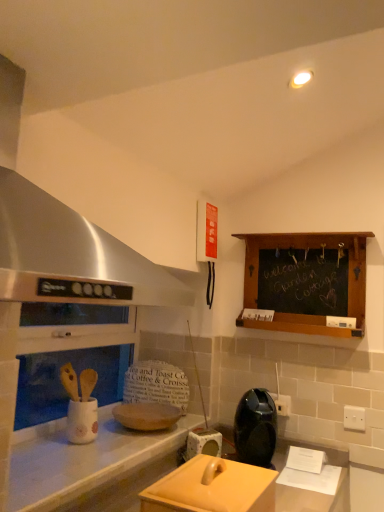
Question: From the image's perspective, is white plastic electric outlet at upper right, the first electric outlet from the right, on top of black plastic electric outlet at center-right, positioned as the 1th electric outlet in left-to-right order?

Choices:
 (A) no
 (B) yes

Answer: (A)

Question: Can you confirm if white plastic electric outlet at upper right, the 2th electric outlet in the left-to-right sequence, is smaller than black plastic electric outlet at center-right, which appears as the second electric outlet when viewed from the right?

Choices:
 (A) yes
 (B) no

Answer: (A)

Question: Does white plastic electric outlet at upper right, the second electric outlet in the back-to-front sequence, appear on the left side of black plastic electric outlet at center-right, the first electric outlet in the back-to-front sequence?

Choices:
 (A) yes
 (B) no

Answer: (B)

Question: Is white plastic electric outlet at upper right, the 2th electric outlet in the left-to-right sequence, taller than black plastic electric outlet at center-right, positioned as the 1th electric outlet in left-to-right order?

Choices:
 (A) yes
 (B) no

Answer: (A)

Question: From a real-world perspective, is white plastic electric outlet at upper right, which ranks as the 1th electric outlet in front-to-back order, physically below black plastic electric outlet at center-right, the 2th electric outlet when ordered from front to back?

Choices:
 (A) no
 (B) yes

Answer: (B)

Question: From the image's perspective, is matte beige toaster at center, arranged as the 1th appliance when viewed from the back, located above or below stainless steel exhaust hood at upper left?

Choices:
 (A) above
 (B) below

Answer: (B)

Question: In the image, is matte beige toaster at center, positioned as the 3th appliance in front-to-back order, positioned in front of or behind stainless steel exhaust hood at upper left?

Choices:
 (A) front
 (B) behind

Answer: (B)

Question: Considering the positions of matte beige toaster at center, positioned as the 3th appliance in front-to-back order, and stainless steel exhaust hood at upper left in the image, is matte beige toaster at center, positioned as the 3th appliance in front-to-back order, taller or shorter than stainless steel exhaust hood at upper left?

Choices:
 (A) tall
 (B) short

Answer: (B)

Question: Considering the relative positions of matte beige toaster at center, positioned as the 3th appliance in front-to-back order, and stainless steel exhaust hood at upper left in the image provided, is matte beige toaster at center, positioned as the 3th appliance in front-to-back order, to the left or to the right of stainless steel exhaust hood at upper left?

Choices:
 (A) left
 (B) right

Answer: (B)

Question: Is point (241, 503) positioned closer to the camera than point (135, 254)?

Choices:
 (A) closer
 (B) farther

Answer: (B)

Question: From a real-world perspective, relative to stainless steel exhaust hood at upper left, is matte yellow lid at center, the 3th appliance when ordered from back to front, vertically above or below?

Choices:
 (A) above
 (B) below

Answer: (B)

Question: Considering the relative positions of matte yellow lid at center, the 3th appliance when ordered from back to front, and stainless steel exhaust hood at upper left in the image provided, is matte yellow lid at center, the 3th appliance when ordered from back to front, to the left or to the right of stainless steel exhaust hood at upper left?

Choices:
 (A) right
 (B) left

Answer: (A)

Question: Looking at their shapes, would you say matte yellow lid at center, which is the first appliance in front-to-back order, is wider or thinner than stainless steel exhaust hood at upper left?

Choices:
 (A) wide
 (B) thin

Answer: (B)

Question: Choose the correct answer: Is white plastic electric outlet at upper right, the first electric outlet from the right, inside matte beige toaster at center, positioned as the 3th appliance in front-to-back order, or outside it?

Choices:
 (A) outside
 (B) inside

Answer: (A)

Question: In terms of width, does white plastic electric outlet at upper right, the first electric outlet from the right, look wider or thinner when compared to matte beige toaster at center, positioned as the 3th appliance in front-to-back order?

Choices:
 (A) wide
 (B) thin

Answer: (B)